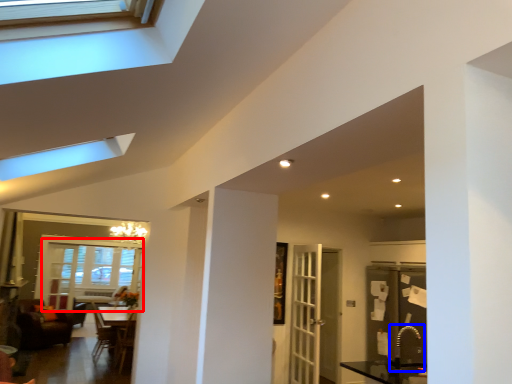
Question: Which object appears closest to the camera in this image, window (highlighted by a red box) or sink (highlighted by a blue box)?

Choices:
 (A) window
 (B) sink

Answer: (B)